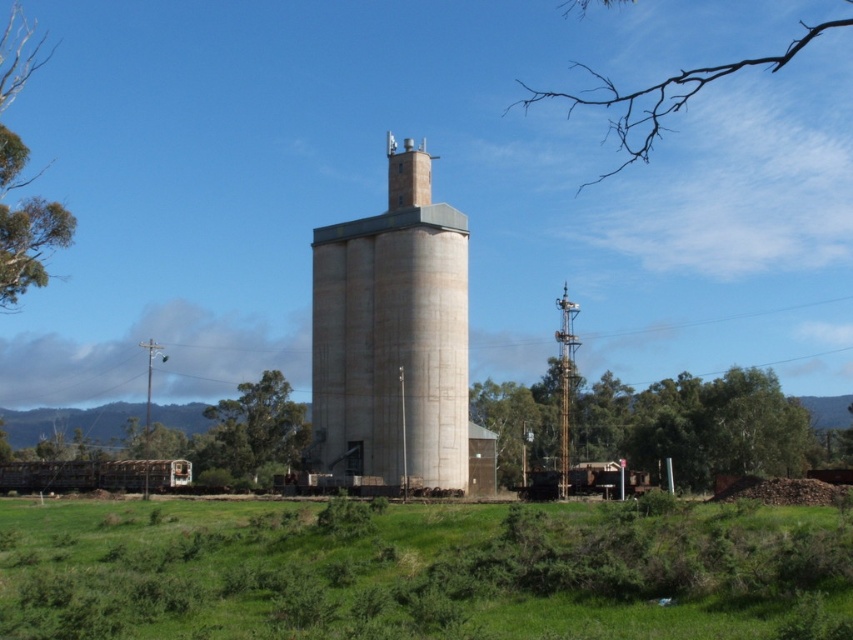
You are standing at the camera position and want to walk to the green grass at center. How far will you have to walk?

The green grass at center is 64.15 feet from the camera, so you will have to walk 64.15 feet to reach it.

You are standing in the rural area near the silo and want to walk from the point at coordinates (16, 38) to the point at coordinates (674, 109). Based on the image, will you have to walk through any obstacles or vegetation along the way?

Point (16, 38) is in front of point (674, 109), so you will have to walk towards the silo, which is in the background. The path between them is through the grassy field with patches of greenery and some shrubs, so yes, you will encounter vegetation along the way.